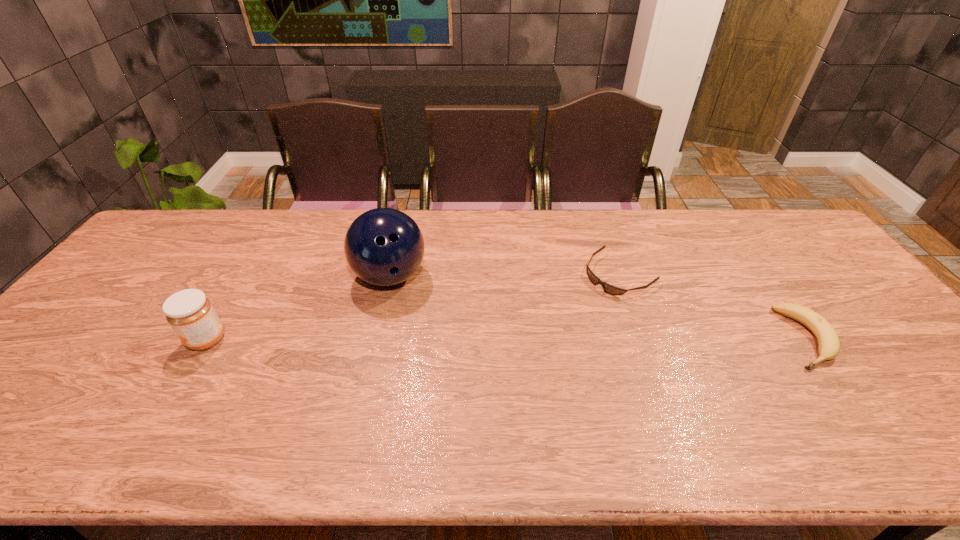
The image size is (960, 540). What are the coordinates of `the second tallest object` in the screenshot? It's located at (189, 312).

Find the location of `jam`. jam is located at coordinates (189, 312).

The image size is (960, 540). Find the location of `the second shortest object`. the second shortest object is located at coordinates (828, 341).

At what (x,y) coordinates should I click in order to perform the action: click on banana. Please return your answer as a coordinate pair (x, y). Looking at the image, I should click on (828, 341).

This screenshot has height=540, width=960. Find the location of `the second object from right to left`. the second object from right to left is located at coordinates (609, 289).

The width and height of the screenshot is (960, 540). In order to click on the shortest object in this screenshot , I will do `click(609, 289)`.

Where is `the tallest object`? This screenshot has height=540, width=960. the tallest object is located at coordinates (383, 246).

Image resolution: width=960 pixels, height=540 pixels. What are the coordinates of `the second object from left to right` in the screenshot? It's located at (383, 246).

This screenshot has width=960, height=540. What are the coordinates of `vacant space positioned on the front label of the leftmost object` in the screenshot? It's located at (121, 340).

Identify the location of vacant space located on the front label of the leftmost object. (129, 340).